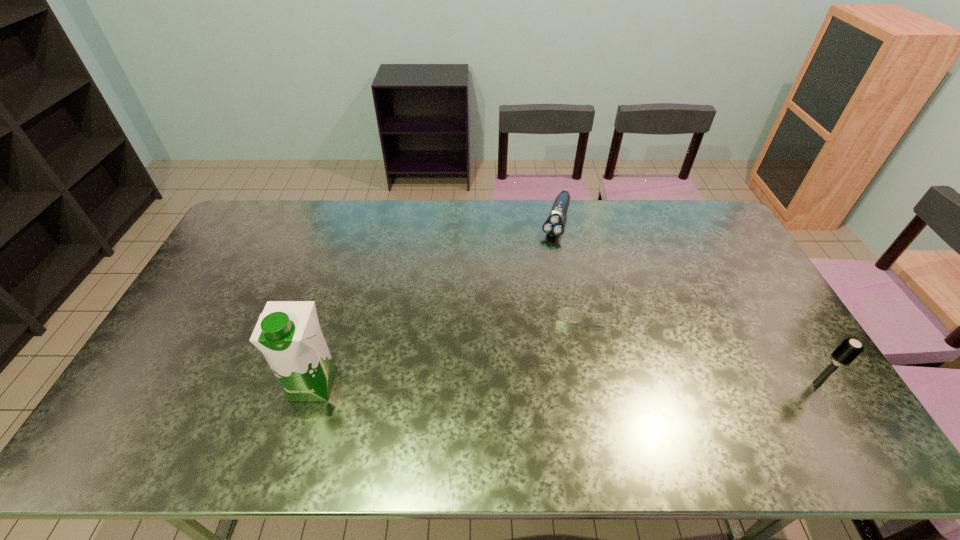
This screenshot has width=960, height=540. In the image, there is a desktop. What are the coordinates of `vacant space at the far edge` in the screenshot? It's located at (641, 230).

In the image, there is a desktop. Identify the location of free space at the near edge. This screenshot has height=540, width=960. (595, 390).

Where is `blank area at the left edge`? The image size is (960, 540). blank area at the left edge is located at coordinates (243, 246).

At what (x,y) coordinates should I click in order to perform the action: click on vacant space at the right edge. Please return your answer as a coordinate pair (x, y). This screenshot has width=960, height=540. Looking at the image, I should click on (761, 352).

The width and height of the screenshot is (960, 540). Identify the location of vacant area at the far right corner of the desktop. (686, 218).

You are a GUI agent. You are given a task and a screenshot of the screen. Output one action in this format:
    pyautogui.click(x=<x>, y=<y>)
    Task: Click on the vacant area between the leftmost object and the spectacles
    The width and height of the screenshot is (960, 540).
    Given the screenshot: What is the action you would take?
    pyautogui.click(x=450, y=343)

Locate an element on the screen. This screenshot has height=540, width=960. unoccupied position between the spectacles and the second tallest object is located at coordinates (702, 343).

Where is `vacant area between the hairbrush and the spectacles`? This screenshot has width=960, height=540. vacant area between the hairbrush and the spectacles is located at coordinates (702, 343).

The image size is (960, 540). I want to click on empty space between the leftmost object and the electric shaver, so click(435, 302).

What are the coordinates of `unoccupied area between the rightmost object and the leftmost object` in the screenshot? It's located at coord(565,383).